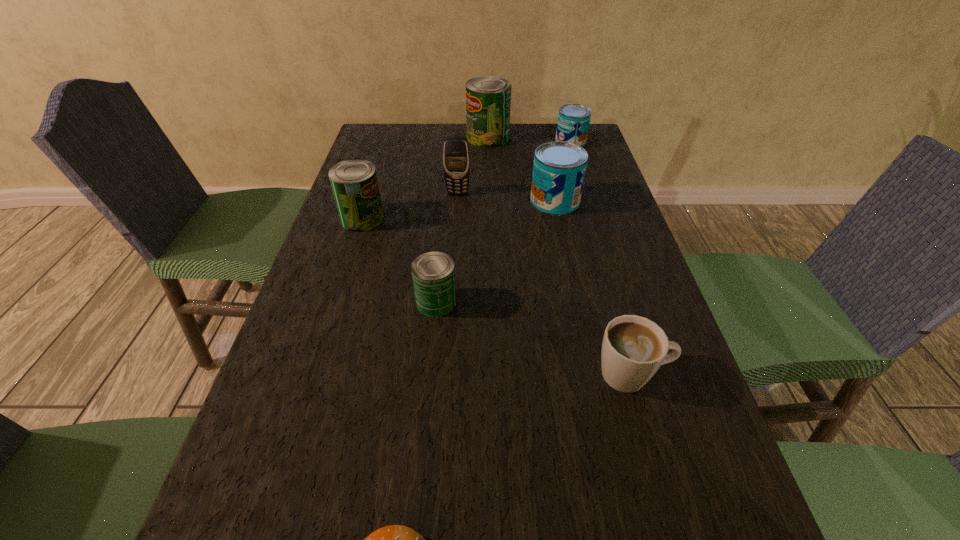
The width and height of the screenshot is (960, 540). I want to click on the farthest green can, so click(488, 99).

Locate an element on the screen. the tallest can is located at coordinates (488, 99).

At what (x,y) coordinates should I click in order to perform the action: click on cellular telephone. Please return your answer as a coordinate pair (x, y). Looking at the image, I should click on (456, 156).

Locate an element on the screen. This screenshot has height=540, width=960. the nearer blue can is located at coordinates (559, 168).

At what (x,y) coordinates should I click in order to perform the action: click on the leftmost can. Please return your answer as a coordinate pair (x, y). The width and height of the screenshot is (960, 540). Looking at the image, I should click on (354, 182).

The image size is (960, 540). In order to click on the second biggest green can in this screenshot , I will do coord(354,182).

Where is `the farther blue can`? the farther blue can is located at coordinates pos(573,122).

Locate an element on the screen. The height and width of the screenshot is (540, 960). the second green can from right to left is located at coordinates (433, 273).

Locate an element on the screen. Image resolution: width=960 pixels, height=540 pixels. the third nearest object is located at coordinates (433, 273).

Where is `the seventh farthest object`? The height and width of the screenshot is (540, 960). the seventh farthest object is located at coordinates (633, 349).